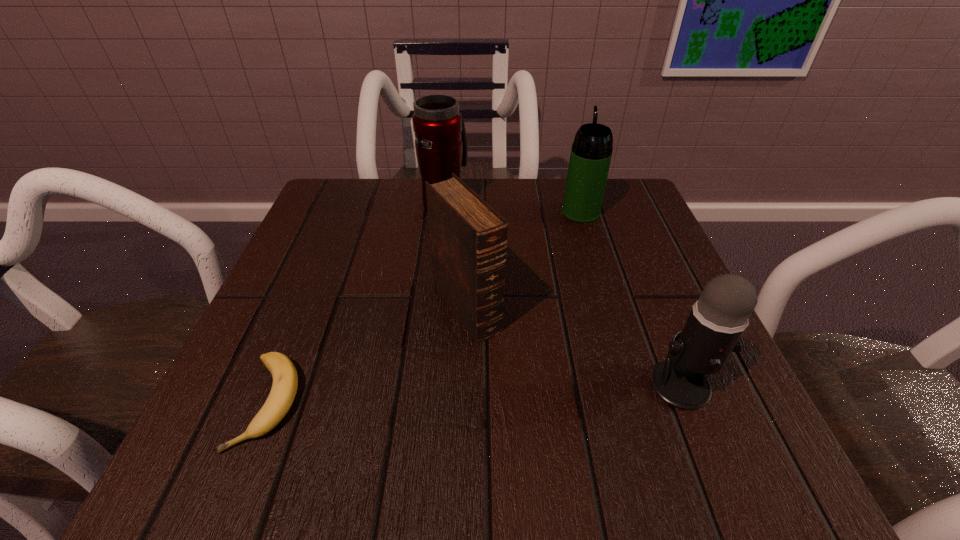
Locate an element on the screen. This screenshot has width=960, height=540. object that stands as the fourth closest to the left thermos bottle is located at coordinates (717, 320).

The image size is (960, 540). Find the location of `object that ranks as the fourth closest to the right thermos bottle`. object that ranks as the fourth closest to the right thermos bottle is located at coordinates (285, 379).

This screenshot has width=960, height=540. What are the coordinates of `vacant region that satisfies the following two spatial constraints: 1. on the front side of the microphone; 2. on the right side of the Bible` in the screenshot? It's located at point(465,384).